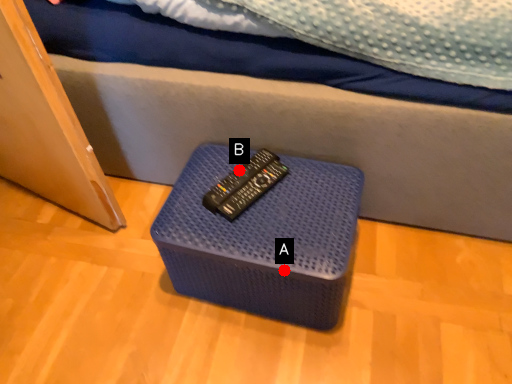
Question: Two points are circled on the image, labeled by A and B beside each circle. Which point is further to the camera?

Choices:
 (A) A is further
 (B) B is further

Answer: (B)